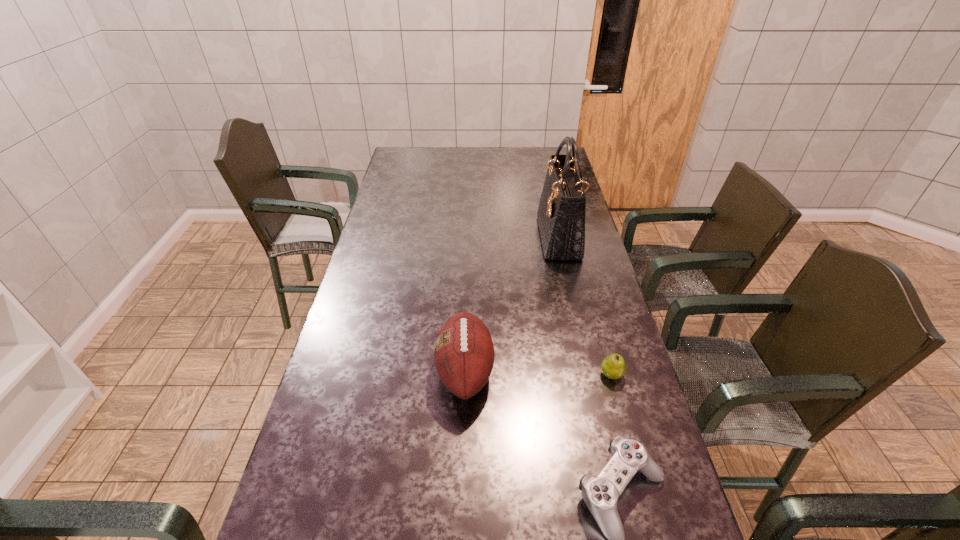
Locate an element on the screen. The height and width of the screenshot is (540, 960). the second closest object to the third shortest object is located at coordinates (613, 366).

Locate an element on the screen. The height and width of the screenshot is (540, 960). object that ranks as the third closest to the leftmost object is located at coordinates (561, 213).

The image size is (960, 540). Identify the location of vacant space that satisfies the following two spatial constraints: 1. on the back side of the pear; 2. at the front of the farthest object with visible charms. (574, 238).

This screenshot has width=960, height=540. In order to click on vacant space that satisfies the following two spatial constraints: 1. on the back side of the second shortest object; 2. at the front of the handbag with visible charms in this screenshot , I will do `click(574, 238)`.

Where is `free point that satisfies the following two spatial constraints: 1. on the back side of the pear; 2. at the front of the farthest object with visible charms`? This screenshot has width=960, height=540. free point that satisfies the following two spatial constraints: 1. on the back side of the pear; 2. at the front of the farthest object with visible charms is located at coordinates (574, 238).

The image size is (960, 540). Identify the location of vacant space that satisfies the following two spatial constraints: 1. at the front of the pear with visible charms; 2. on the left side of the handbag. (589, 374).

Locate an element on the screen. This screenshot has width=960, height=540. blank area in the image that satisfies the following two spatial constraints: 1. on the back side of the pear; 2. at the front of the farthest object with visible charms is located at coordinates (574, 238).